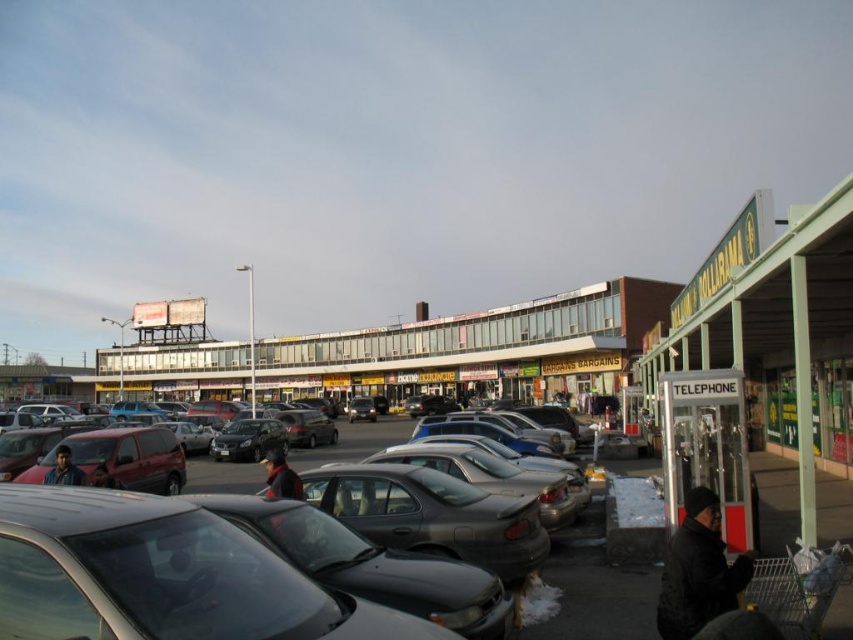
Question: Where is shiny gray car at center located in relation to metallic gray sedan at center in the image?

Choices:
 (A) below
 (B) above

Answer: (B)

Question: Based on their relative distances, which object is nearer to the metallic gray sedan at center?

Choices:
 (A) glassy storefronts at center
 (B) shiny gray car at center

Answer: (B)

Question: Which point is closer to the camera?

Choices:
 (A) shiny gray car at center
 (B) glassy storefronts at center
 (C) metallic gray sedan at center

Answer: (A)

Question: Does glassy storefronts at center have a lesser width compared to metallic gray sedan at center?

Choices:
 (A) no
 (B) yes

Answer: (A)

Question: Which point is farther to the camera?

Choices:
 (A) (131, 456)
 (B) (547, 390)

Answer: (B)

Question: Does shiny gray car at center have a smaller size compared to metallic gray sedan at center?

Choices:
 (A) yes
 (B) no

Answer: (B)